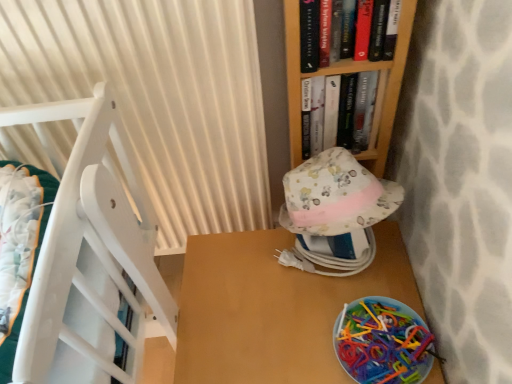
Find the location of a particular element. Image resolution: width=512 pixels, height=384 pixels. vacant space in front of floral fabric hat at center is located at coordinates (315, 331).